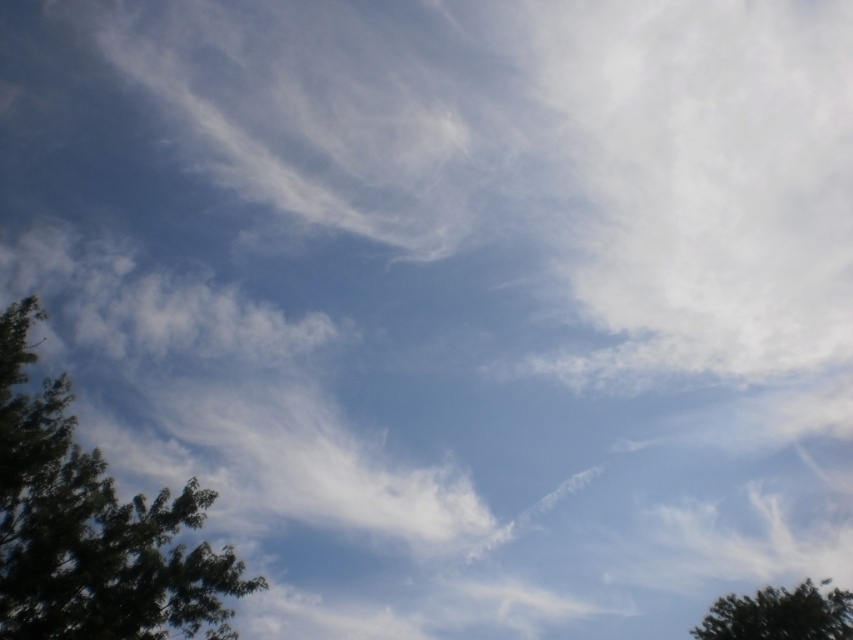
Question: Is green leafy tree at left positioned in front of green leafy tree at lower right?

Choices:
 (A) no
 (B) yes

Answer: (B)

Question: Is green leafy tree at left smaller than green leafy tree at lower right?

Choices:
 (A) yes
 (B) no

Answer: (A)

Question: Is green leafy tree at left behind green leafy tree at lower right?

Choices:
 (A) no
 (B) yes

Answer: (A)

Question: Among these points, which one is nearest to the camera?

Choices:
 (A) (138, 586)
 (B) (821, 595)

Answer: (A)

Question: Among these points, which one is nearest to the camera?

Choices:
 (A) (215, 563)
 (B) (851, 611)

Answer: (A)

Question: Among these points, which one is nearest to the camera?

Choices:
 (A) (125, 531)
 (B) (730, 602)

Answer: (A)